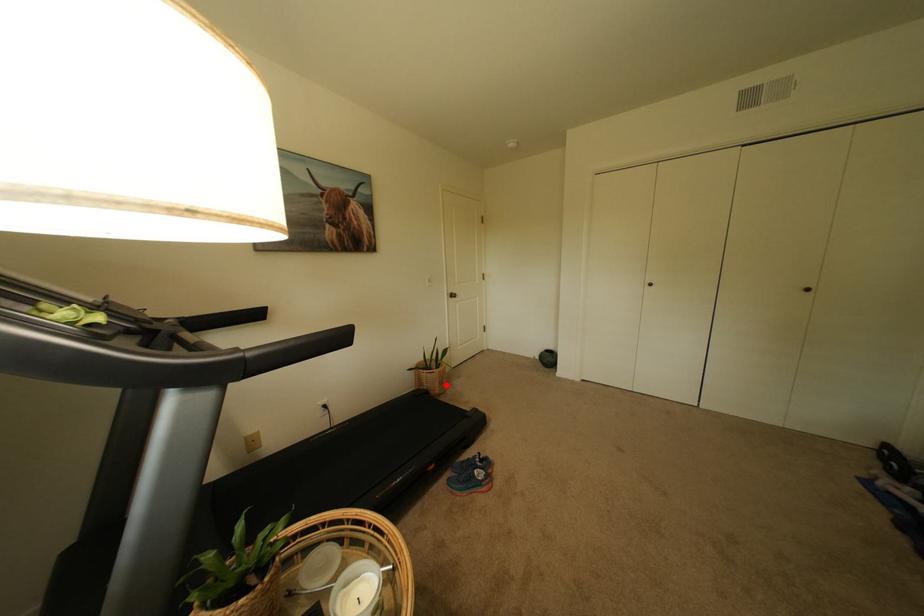
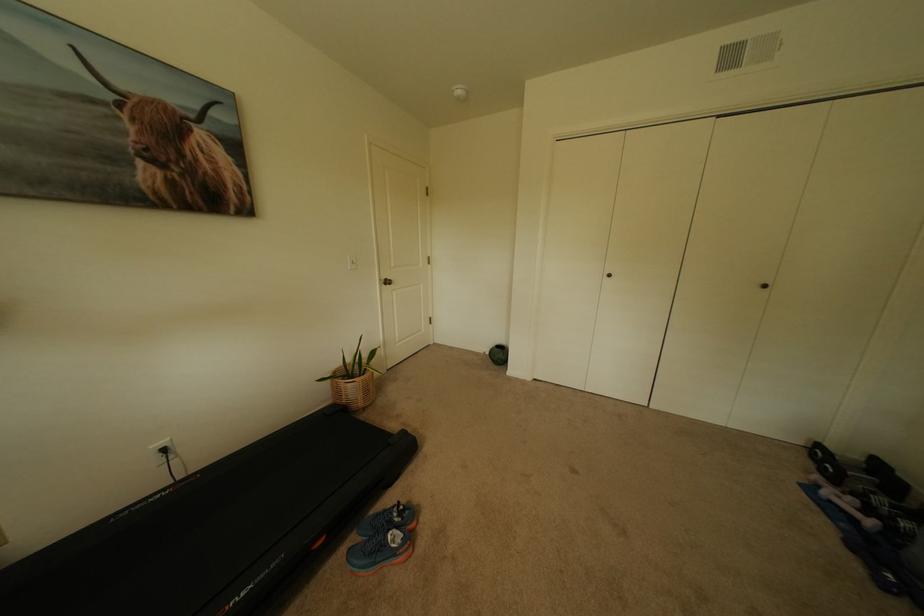
Locate, in the second image, the point that corresponds to the highlighted location in the first image.

(370, 395)